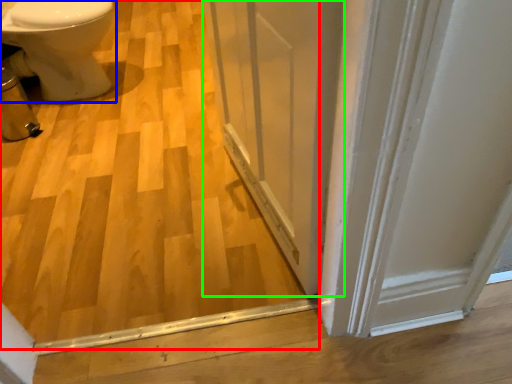
Question: Based on their relative distances, which object is nearer to plywood (highlighted by a red box)? Choose from bidet (highlighted by a blue box) and screen door (highlighted by a green box).

Choices:
 (A) bidet
 (B) screen door

Answer: (B)